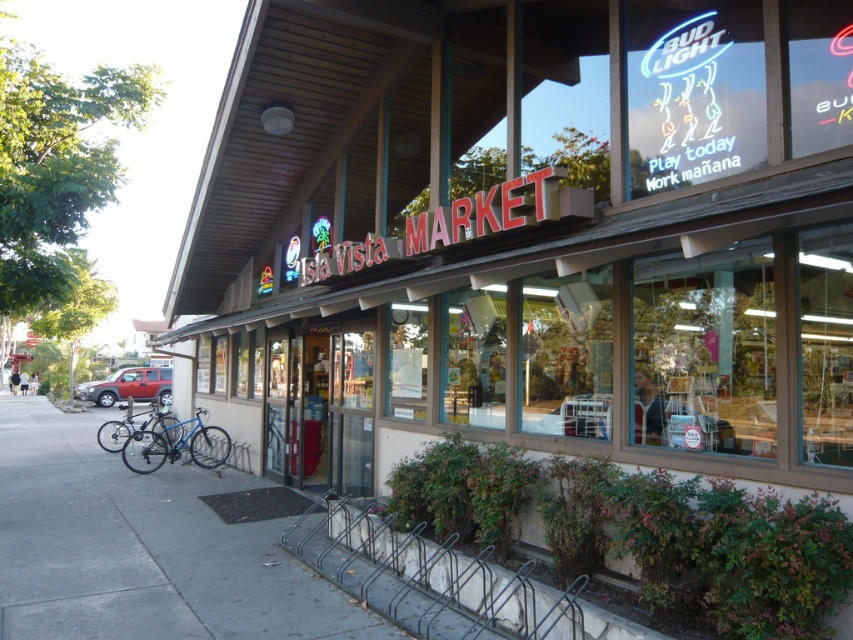
Measure the distance between gray concrete bike rack at lower center and camera.

gray concrete bike rack at lower center and camera are 13.06 feet apart.

Consider the image. Who is higher up, gray concrete bike rack at lower center or blue metallic bicycle at lower left?

gray concrete bike rack at lower center

Image resolution: width=853 pixels, height=640 pixels. Identify the location of gray concrete bike rack at lower center. (480, 582).

Looking at this image, can you confirm if blue metallic bicycle at lower left is wider than matte red suv at lower left?

Yes, blue metallic bicycle at lower left is wider than matte red suv at lower left.

Is point (151, 470) farther from camera compared to point (149, 378)?

That is False.

Image resolution: width=853 pixels, height=640 pixels. What are the coordinates of `blue metallic bicycle at lower left` in the screenshot? It's located at click(175, 444).

Who is more distant from viewer, (212,444) or (157,396)?

The point (157,396) is more distant.

Which is in front, point (154, 467) or point (123, 436)?

Positioned in front is point (154, 467).

Does point (196, 426) lie behind point (119, 420)?

No, it is in front of (119, 420).

Find the location of a particular element. The width and height of the screenshot is (853, 640). blue metallic bicycle at lower left is located at coordinates (175, 444).